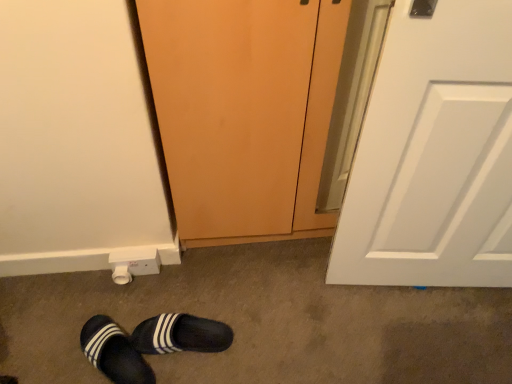
Question: Is black suede slippers at lower left, the 1th footwear positioned from the right, oriented towards matte wood screen door at center?

Choices:
 (A) yes
 (B) no

Answer: (B)

Question: From a real-world perspective, is black suede slippers at lower left, which is the second footwear in left-to-right order, on matte wood screen door at center?

Choices:
 (A) yes
 (B) no

Answer: (B)

Question: Considering the relative sizes of black suede slippers at lower left, the 1th footwear positioned from the right, and matte wood screen door at center in the image provided, is black suede slippers at lower left, the 1th footwear positioned from the right, smaller than matte wood screen door at center?

Choices:
 (A) no
 (B) yes

Answer: (B)

Question: Is black suede slippers at lower left, the 1th footwear positioned from the right, placed right next to matte wood screen door at center?

Choices:
 (A) no
 (B) yes

Answer: (A)

Question: From a real-world perspective, is black suede slippers at lower left, the 1th footwear positioned from the right, located beneath matte wood screen door at center?

Choices:
 (A) no
 (B) yes

Answer: (B)

Question: Considering the relative positions of white plastic electric outlet at lower left and black fabric slippers at lower left, arranged as the 1th footwear when viewed from the left, in the image provided, is white plastic electric outlet at lower left to the left or to the right of black fabric slippers at lower left, arranged as the 1th footwear when viewed from the left,?

Choices:
 (A) right
 (B) left

Answer: (A)

Question: From the image's perspective, is white plastic electric outlet at lower left located above or below black fabric slippers at lower left, marked as the 2th footwear in a right-to-left arrangement?

Choices:
 (A) below
 (B) above

Answer: (B)

Question: Based on their sizes in the image, would you say white plastic electric outlet at lower left is bigger or smaller than black fabric slippers at lower left, marked as the 2th footwear in a right-to-left arrangement?

Choices:
 (A) small
 (B) big

Answer: (A)

Question: Is white plastic electric outlet at lower left inside the boundaries of black fabric slippers at lower left, arranged as the 1th footwear when viewed from the left, or outside?

Choices:
 (A) inside
 (B) outside

Answer: (B)

Question: Is black fabric slippers at lower left, marked as the 2th footwear in a right-to-left arrangement, inside or outside of matte wood screen door at center?

Choices:
 (A) outside
 (B) inside

Answer: (A)

Question: In terms of size, does black fabric slippers at lower left, arranged as the 1th footwear when viewed from the left, appear bigger or smaller than matte wood screen door at center?

Choices:
 (A) big
 (B) small

Answer: (B)

Question: From the image's perspective, is black fabric slippers at lower left, marked as the 2th footwear in a right-to-left arrangement, positioned above or below matte wood screen door at center?

Choices:
 (A) above
 (B) below

Answer: (B)

Question: Is black fabric slippers at lower left, arranged as the 1th footwear when viewed from the left, wider or thinner than matte wood screen door at center?

Choices:
 (A) wide
 (B) thin

Answer: (B)

Question: Considering the positions of matte wood screen door at center and black suede slippers at lower left, which is the second footwear in left-to-right order, in the image, is matte wood screen door at center taller or shorter than black suede slippers at lower left, which is the second footwear in left-to-right order,?

Choices:
 (A) tall
 (B) short

Answer: (A)

Question: Is matte wood screen door at center bigger or smaller than black suede slippers at lower left, which is the second footwear in left-to-right order?

Choices:
 (A) big
 (B) small

Answer: (A)